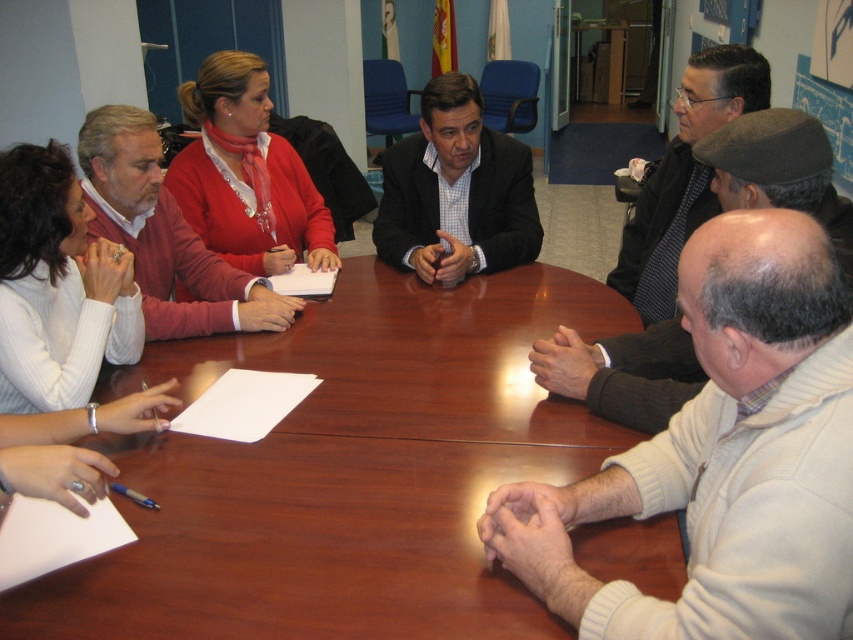
You are standing in the meeting room and want to place a 1.2 meter long banner between you and the point at coordinates point (461, 611). Will the banner fit without overlapping anything?

The distance between you and the point (461, 611) is 1.09 meters. Since the banner is 1.2 meters long, it will not fit as it is longer than the available space.

You are a photographer positioned at the center of the circular table. You want to take a photo of the dark gray textured jacket at upper right and the matte red sweater at upper left. Which object should you move closer to the camera to ensure both are in focus?

The dark gray textured jacket at upper right is behind the matte red sweater at upper left, so you should move the dark gray textured jacket at upper right closer to the camera to ensure both are in focus.

You are a photographer positioned at the back of the meeting room. You need to capture a photo where both the white knit sweater at center and the dark gray knit cap at upper right are clearly visible. Considering their heights, which object should you focus on first to ensure both are in frame?

The white knit sweater at center is taller than the dark gray knit cap at upper right. To ensure both are in frame, focus on the taller object first, which is the white knit sweater at center, as it requires more space in the composition.